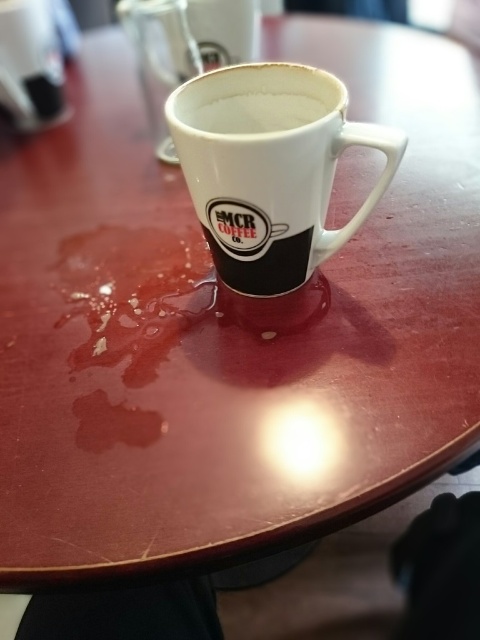
Is white ceramic mug at center shorter than white matte cup at center?

In fact, white ceramic mug at center may be taller than white matte cup at center.

The height and width of the screenshot is (640, 480). What are the coordinates of `white ceramic mug at center` in the screenshot? It's located at (269, 168).

The width and height of the screenshot is (480, 640). What are the coordinates of `white ceramic mug at center` in the screenshot? It's located at (269, 168).

Is white ceramic mug at center further to the viewer compared to white glossy saucer at upper left?

No, it is not.

How distant is white ceramic mug at center from white glossy saucer at upper left?

They are 27.73 inches apart.

Locate an element on the screen. white ceramic mug at center is located at coordinates (269, 168).

Does point (261, 129) lie behind point (41, 122)?

No, it is in front of (41, 122).

At what (x,y) coordinates should I click in order to perform the action: click on white matte cup at center. Please return your answer as a coordinate pair (x, y). This screenshot has width=480, height=640. Looking at the image, I should click on (257, 113).

Does point (238, 113) lie behind point (19, 128)?

No.

Find the location of a particular element. The image size is (480, 640). white matte cup at center is located at coordinates (257, 113).